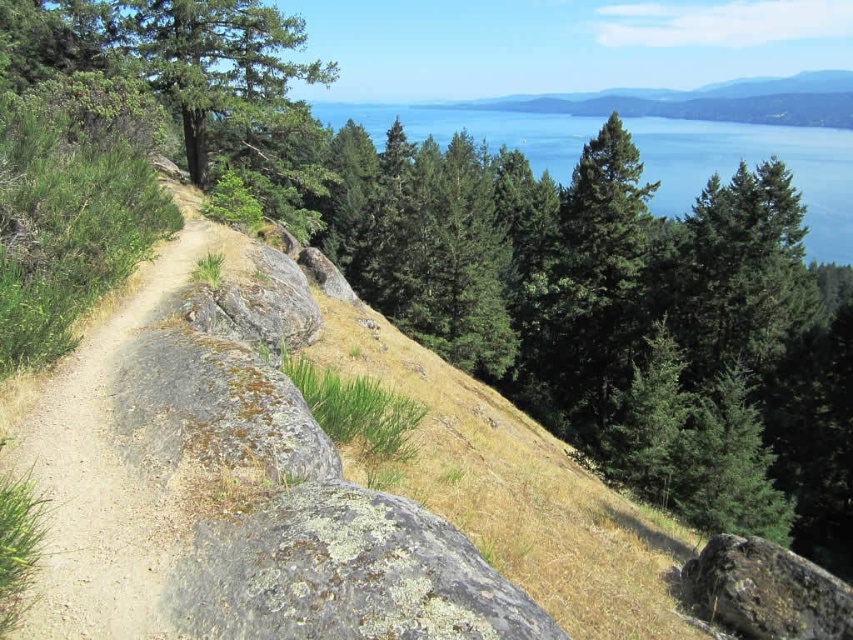
Is speckled gray rock at lower right shorter than green grassy at center?

No.

Describe the element at coordinates (766, 589) in the screenshot. This screenshot has height=640, width=853. I see `speckled gray rock at lower right` at that location.

Between point (708, 561) and point (218, 273), which one is positioned behind?

The point (218, 273) is behind.

I want to click on speckled gray rock at lower right, so click(766, 589).

The height and width of the screenshot is (640, 853). I want to click on dirt path at left, so click(97, 468).

Is point (109, 602) behind point (802, 561)?

No, (109, 602) is closer to viewer.

At what (x,y) coordinates should I click in order to perform the action: click on dirt path at left. Please return your answer as a coordinate pair (x, y). Looking at the image, I should click on (97, 468).

Who is positioned more to the right, lichen-covered rock at center or speckled gray rock at lower right?

From the viewer's perspective, speckled gray rock at lower right appears more on the right side.

Is lichen-covered rock at center to the left of speckled gray rock at lower right from the viewer's perspective?

Correct, you'll find lichen-covered rock at center to the left of speckled gray rock at lower right.

Is point (492, 572) more distant than point (730, 563)?

No, (492, 572) is in front of (730, 563).

Identify the location of lichen-covered rock at center. (345, 573).